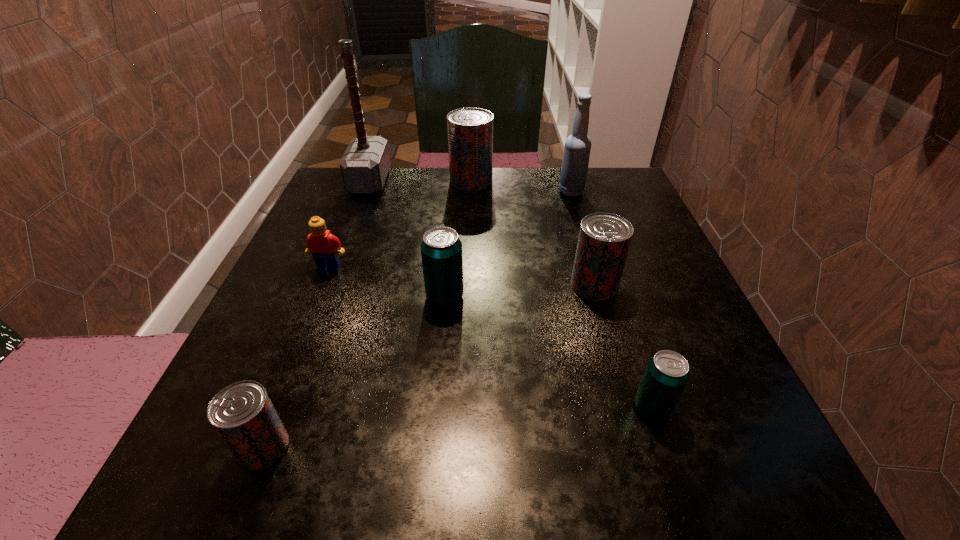
At what (x,y) coordinates should I click in order to perform the action: click on the fifth closest object to the second red beer can from left to right. Please return your answer as a coordinate pair (x, y). Looking at the image, I should click on 441,250.

This screenshot has width=960, height=540. Find the location of `beer can identified as the second closest to the nearer teal beer can`. beer can identified as the second closest to the nearer teal beer can is located at coordinates (441, 250).

The width and height of the screenshot is (960, 540). I want to click on beer can object that ranks as the fourth closest to the left teal beer can, so click(470, 130).

Choose which red beer can is the nearest neighbor to the hammer. Please provide its 2D coordinates. Your answer should be formatted as a tuple, i.e. [(x, y)], where the tuple contains the x and y coordinates of a point satisfying the conditions above.

[(470, 130)]

Locate which red beer can is the closest to the farthest red beer can. Please provide its 2D coordinates. Your answer should be formatted as a tuple, i.e. [(x, y)], where the tuple contains the x and y coordinates of a point satisfying the conditions above.

[(604, 239)]

Identify the location of vacant area that satisfies the following two spatial constraints: 1. on the back side of the biggest red beer can; 2. on the left side of the bigger teal beer can. (455, 181).

In order to click on free location that satisfies the following two spatial constraints: 1. on the front side of the farthest red beer can; 2. on the left side of the bottle in this screenshot , I will do `click(470, 192)`.

The width and height of the screenshot is (960, 540). Identify the location of vacant area in the image that satisfies the following two spatial constraints: 1. on the striking surface of the left teal beer can; 2. on the right side of the brown hammer. (325, 296).

At what (x,y) coordinates should I click in order to perform the action: click on vacant space that satisfies the following two spatial constraints: 1. on the face of the Lego; 2. on the left side of the left teal beer can. Please return your answer as a coordinate pair (x, y). Looking at the image, I should click on (318, 296).

Find the location of a particular element. Image resolution: width=960 pixels, height=540 pixels. vacant space that satisfies the following two spatial constraints: 1. on the face of the seventh farthest object; 2. on the left side of the Lego is located at coordinates (274, 408).